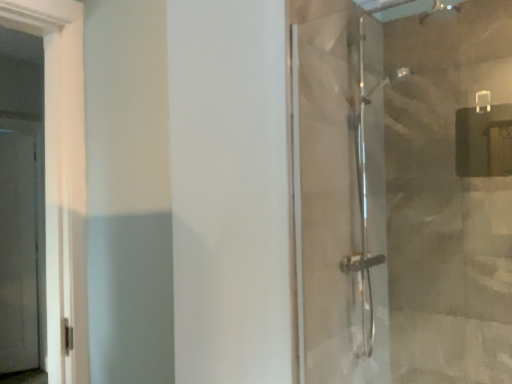
Describe the element at coordinates (19, 247) in the screenshot. I see `clear glass screen door at left` at that location.

In order to click on clear glass screen door at left in this screenshot , I will do `click(19, 247)`.

The width and height of the screenshot is (512, 384). What do you see at coordinates (341, 197) in the screenshot?
I see `transparent glass shower door at right` at bounding box center [341, 197].

Find the location of a particular element. The image size is (512, 384). transparent glass shower door at right is located at coordinates (341, 197).

Measure the distance between point (364, 18) and camera.

Point (364, 18) and camera are 2.09 meters apart.

What is the approximate width of transparent glass shower door at right?

It is 0.56 inches.

The width and height of the screenshot is (512, 384). I want to click on clear glass screen door at left, so click(x=19, y=247).

Does transparent glass shower door at right appear on the left side of clear glass screen door at left?

No.

Which object is further away from the camera taking this photo, transparent glass shower door at right or clear glass screen door at left?

Positioned behind is clear glass screen door at left.

Considering the positions of points (380, 49) and (25, 332), is point (380, 49) closer to camera compared to point (25, 332)?

Yes, it is.

From the image's perspective, would you say transparent glass shower door at right is positioned over clear glass screen door at left?

Yes, from the image's perspective, transparent glass shower door at right is over clear glass screen door at left.

From a real-world perspective, which is physically above, transparent glass shower door at right or clear glass screen door at left?

transparent glass shower door at right is physically above.

Can you confirm if transparent glass shower door at right is thinner than clear glass screen door at left?

Indeed, transparent glass shower door at right has a lesser width compared to clear glass screen door at left.

Can you confirm if transparent glass shower door at right is taller than clear glass screen door at left?

No, transparent glass shower door at right is not taller than clear glass screen door at left.

Can you confirm if transparent glass shower door at right is smaller than clear glass screen door at left?

Yes.

Is transparent glass shower door at right inside the boundaries of clear glass screen door at left, or outside?

transparent glass shower door at right cannot be found inside clear glass screen door at left.

Is transparent glass shower door at right in contact with clear glass screen door at left?

No, transparent glass shower door at right is not making contact with clear glass screen door at left.

Looking at this image, is transparent glass shower door at right turned away from clear glass screen door at left?

No, transparent glass shower door at right is not facing away from clear glass screen door at left.

Measure the distance between transparent glass shower door at right and clear glass screen door at left.

The distance of transparent glass shower door at right from clear glass screen door at left is 9.20 feet.

This screenshot has height=384, width=512. I want to click on screen door that appears below the transparent glass shower door at right (from the image's perspective), so click(19, 247).

Considering the relative positions of clear glass screen door at left and transparent glass shower door at right in the image provided, is clear glass screen door at left to the left or to the right of transparent glass shower door at right?

Based on their positions, clear glass screen door at left is located to the left of transparent glass shower door at right.

Considering the positions of objects clear glass screen door at left and transparent glass shower door at right in the image provided, who is behind, clear glass screen door at left or transparent glass shower door at right?

clear glass screen door at left.

Considering the positions of point (14, 185) and point (340, 221), is point (14, 185) closer or farther from the camera than point (340, 221)?

Point (14, 185) is farther from the camera than point (340, 221).

From the image's perspective, does clear glass screen door at left appear lower than transparent glass shower door at right?

Yes, from the image's perspective, clear glass screen door at left is beneath transparent glass shower door at right.

From a real-world perspective, who is located higher, clear glass screen door at left or transparent glass shower door at right?

From a 3D spatial view, transparent glass shower door at right is above.

Based on the photo, which of these two, clear glass screen door at left or transparent glass shower door at right, is wider?

With larger width is clear glass screen door at left.

Considering the relative sizes of clear glass screen door at left and transparent glass shower door at right in the image provided, is clear glass screen door at left taller than transparent glass shower door at right?

Yes, clear glass screen door at left is taller than transparent glass shower door at right.

Considering the relative sizes of clear glass screen door at left and transparent glass shower door at right in the image provided, is clear glass screen door at left smaller than transparent glass shower door at right?

No.

Is transparent glass shower door at right a part of clear glass screen door at left?

No.

Is there a large distance between clear glass screen door at left and transparent glass shower door at right?

Indeed, clear glass screen door at left is not near transparent glass shower door at right.

Is transparent glass shower door at right at the back of clear glass screen door at left?

No, transparent glass shower door at right is not at the back of clear glass screen door at left.

Measure the distance from clear glass screen door at left to transparent glass shower door at right.

A distance of 9.20 feet exists between clear glass screen door at left and transparent glass shower door at right.

I want to click on shower door located in front of the clear glass screen door at left, so click(x=341, y=197).

Locate an element on the screen. shower door in front of the clear glass screen door at left is located at coordinates (341, 197).

Identify the location of shower door that appears on the right of clear glass screen door at left. (341, 197).